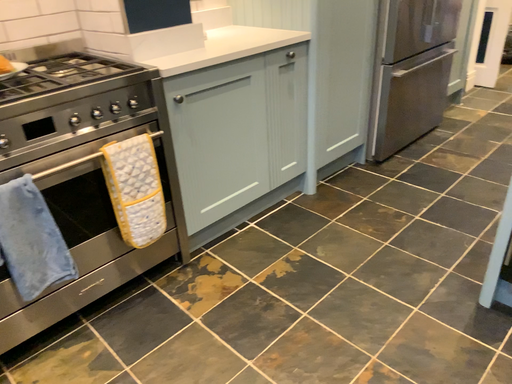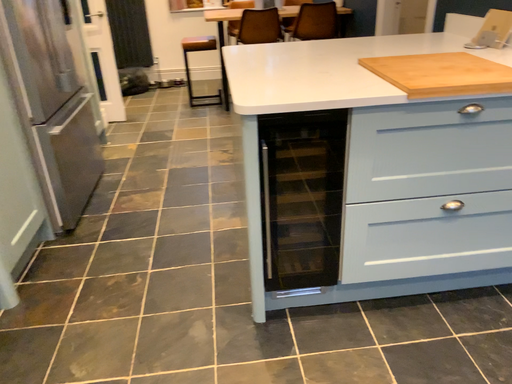
Question: Which way did the camera rotate in the video?

Choices:
 (A) rotated downward
 (B) rotated upward

Answer: (B)